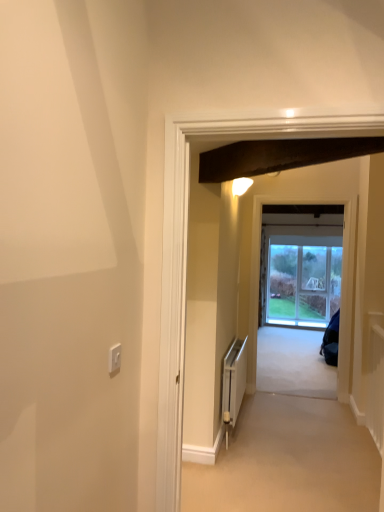
Image resolution: width=384 pixels, height=512 pixels. Describe the element at coordinates (234, 380) in the screenshot. I see `white glossy radiator at lower right` at that location.

Locate an element on the screen. white glossy radiator at lower right is located at coordinates (234, 380).

What are the coordinates of `white glossy radiator at lower right` in the screenshot? It's located at (234, 380).